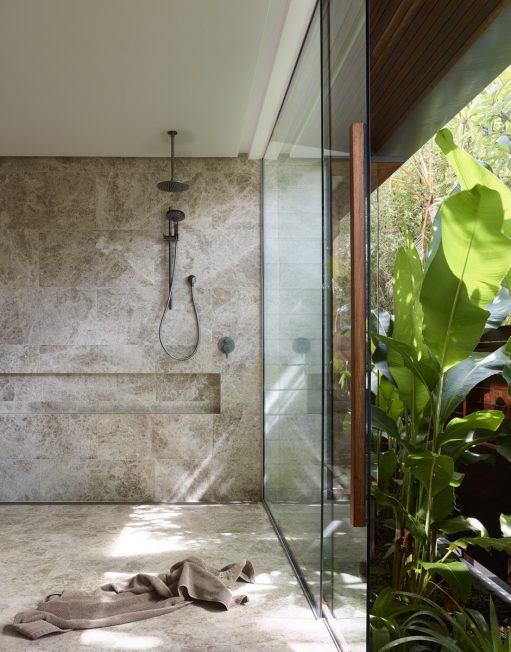
This screenshot has width=511, height=652. Identify the location of shower cord. (197, 313).